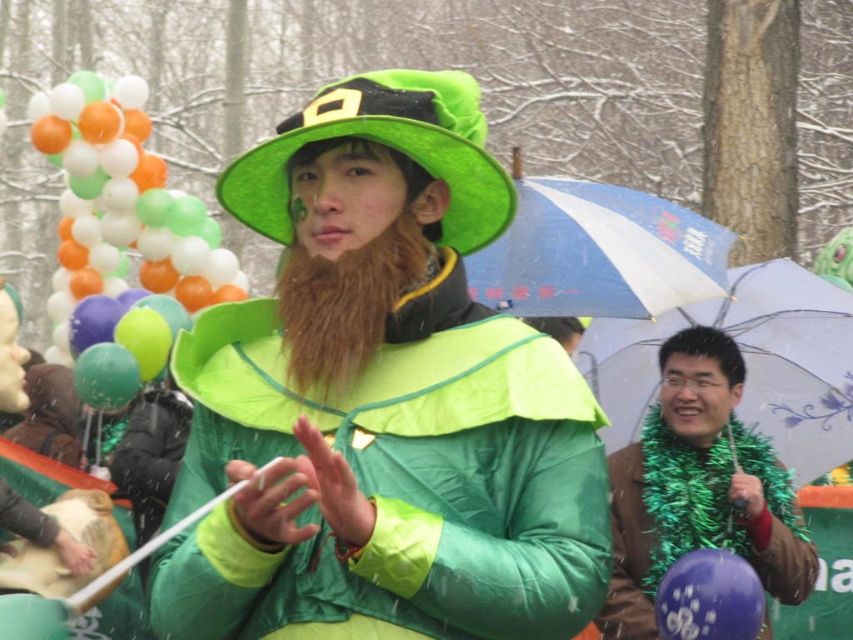
Question: Can you confirm if transparent plastic umbrella at right is positioned above green matte balloons at left?

Choices:
 (A) no
 (B) yes

Answer: (A)

Question: Is green matte hat at center smaller than green matte balloons at left?

Choices:
 (A) yes
 (B) no

Answer: (A)

Question: Estimate the real-world distances between objects in this image. Which object is closer to the green matte hat at center?

Choices:
 (A) brown leather jacket at lower right
 (B) green matte balloons at left

Answer: (A)

Question: Does green matte hat at center have a lesser width compared to transparent plastic umbrella at right?

Choices:
 (A) yes
 (B) no

Answer: (A)

Question: Which point is closer to the camera taking this photo?

Choices:
 (A) (798, 592)
 (B) (607, 320)
 (C) (84, 109)

Answer: (A)

Question: Based on their relative distances, which object is nearer to the green matte hat at center?

Choices:
 (A) shiny purple balloon at lower right
 (B) blue printed umbrella at center

Answer: (A)